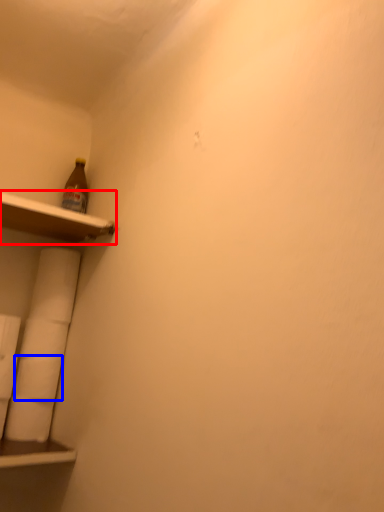
Question: Which point is further to the camera, shelf (highlighted by a red box) or toilet paper (highlighted by a blue box)?

Choices:
 (A) shelf
 (B) toilet paper

Answer: (B)